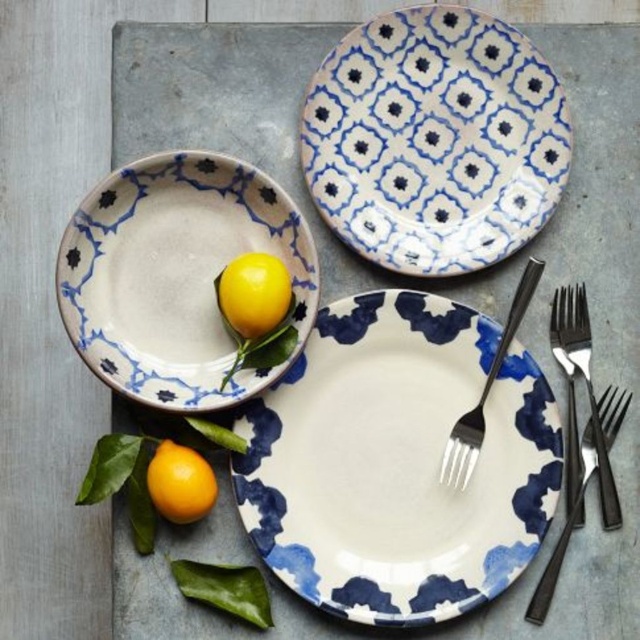
You are arranging a table setting and need to place the white glossy plate at center and the black metallic fork at center. According to the image, which item is located to the right of the other?

The black metallic fork at center is located to the right of the white glossy plate at center because the white glossy plate at center is positioned on the left side of the black metallic fork at center.

You are arranging a still life setup and need to place the matte ceramic bowl at upper left and the yellow matte lemon at lower left. According to the image, where should the lemon be positioned relative to the bowl?

The matte ceramic bowl at upper left is to the right of the yellow matte lemon at lower left, so the lemon should be placed to the left of the bowl.